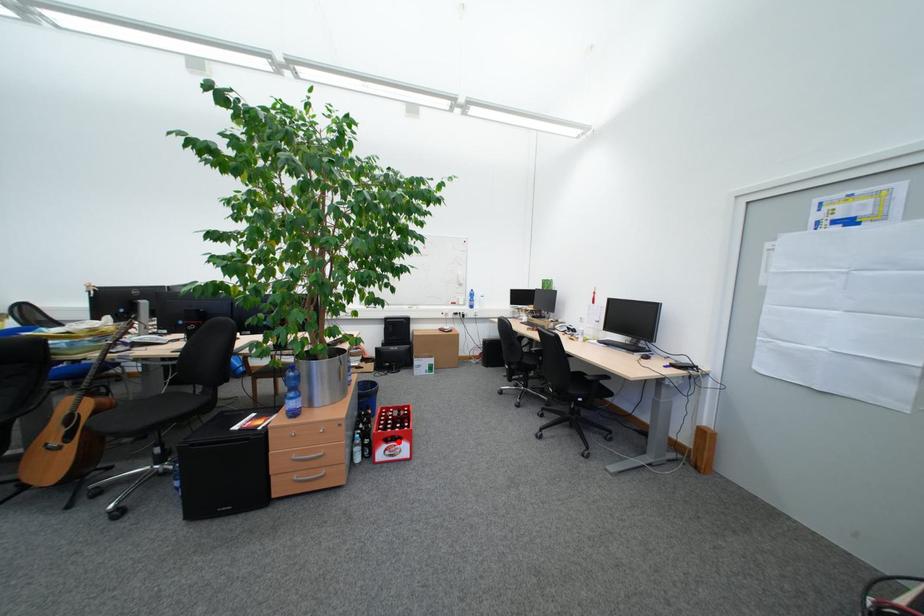
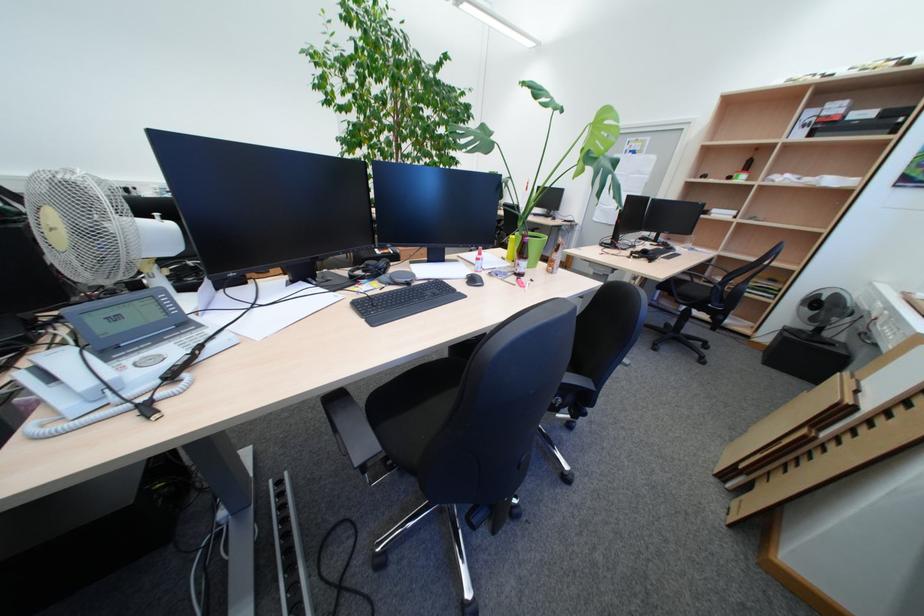
Question: I am providing you with two images of the same scene from different viewpoints. A red point is marked on the first image. Can you still see the location of the red point in image 2?

Choices:
 (A) Yes
 (B) No

Answer: (B)